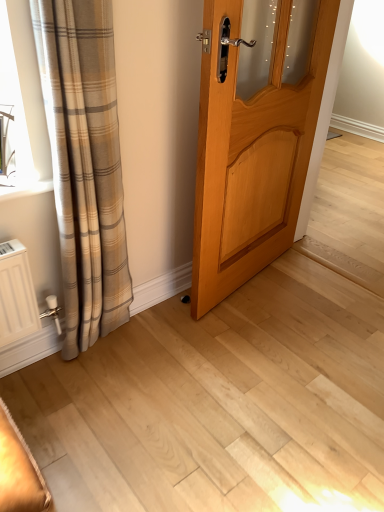
Where is `vacant space to the right of light wood door at center`? vacant space to the right of light wood door at center is located at coordinates (318, 288).